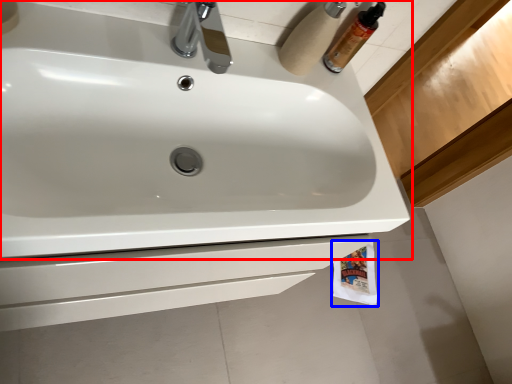
Question: Which point is closer to the camera, sink (highlighted by a red box) or toilet paper (highlighted by a blue box)?

Choices:
 (A) sink
 (B) toilet paper

Answer: (A)